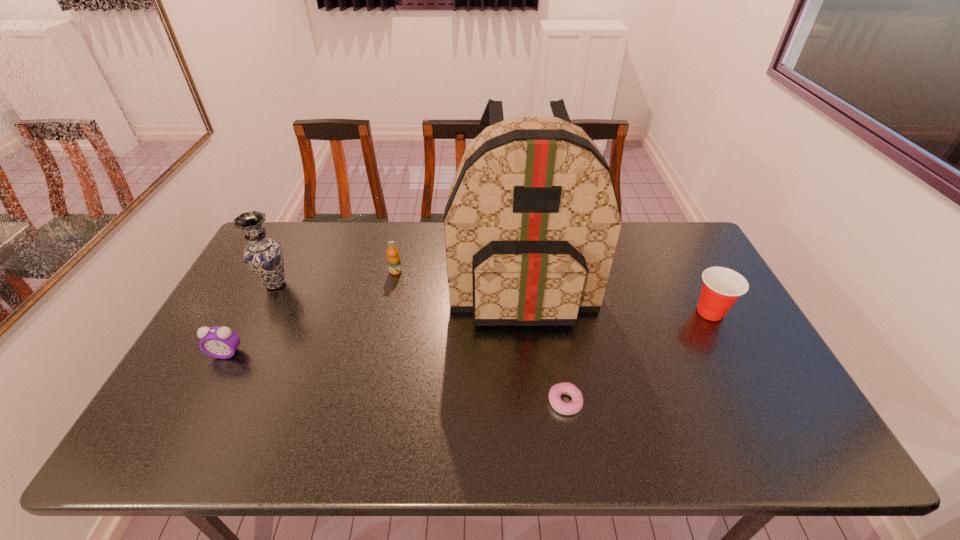
You are a GUI agent. You are given a task and a screenshot of the screen. Output one action in this format:
    pyautogui.click(x=<x>, y=<y>)
    Task: Click on the backpack
    The width and height of the screenshot is (960, 540).
    Given the screenshot: What is the action you would take?
    pyautogui.click(x=532, y=220)

Where is `the fifth shortest object`? Image resolution: width=960 pixels, height=540 pixels. the fifth shortest object is located at coordinates (263, 256).

Locate an element on the screen. The height and width of the screenshot is (540, 960). the rightmost object is located at coordinates (722, 286).

This screenshot has width=960, height=540. Find the location of `orange juice`. orange juice is located at coordinates (393, 258).

Image resolution: width=960 pixels, height=540 pixels. What are the coordinates of `the second nearest object` in the screenshot? It's located at (219, 342).

The image size is (960, 540). In order to click on alarm clock in this screenshot , I will do 219,342.

Find the location of a particular element. This screenshot has width=960, height=540. the shortest object is located at coordinates (566, 408).

Where is `pastry`? pastry is located at coordinates (566, 408).

This screenshot has height=540, width=960. Find the location of `vacant space located 0.250m on the front face of the backpack`. vacant space located 0.250m on the front face of the backpack is located at coordinates (535, 410).

This screenshot has height=540, width=960. I want to click on free location located on the right of the vase, so click(408, 284).